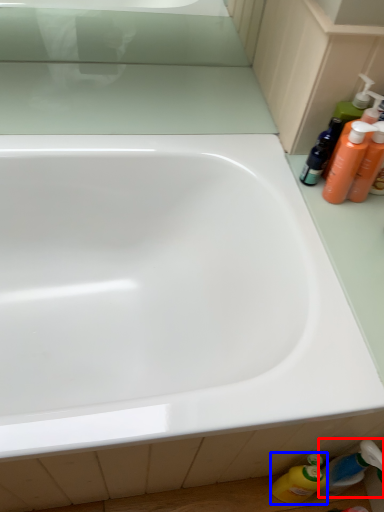
Question: Which object appears farthest to the camera in this image, toiletry (highlighted by a red box) or cleaning product (highlighted by a blue box)?

Choices:
 (A) toiletry
 (B) cleaning product

Answer: (B)